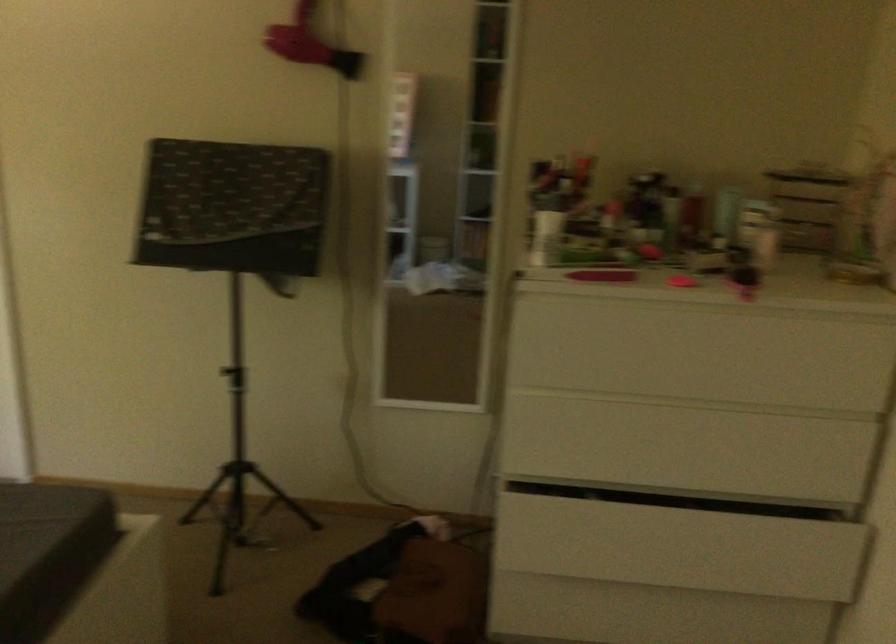
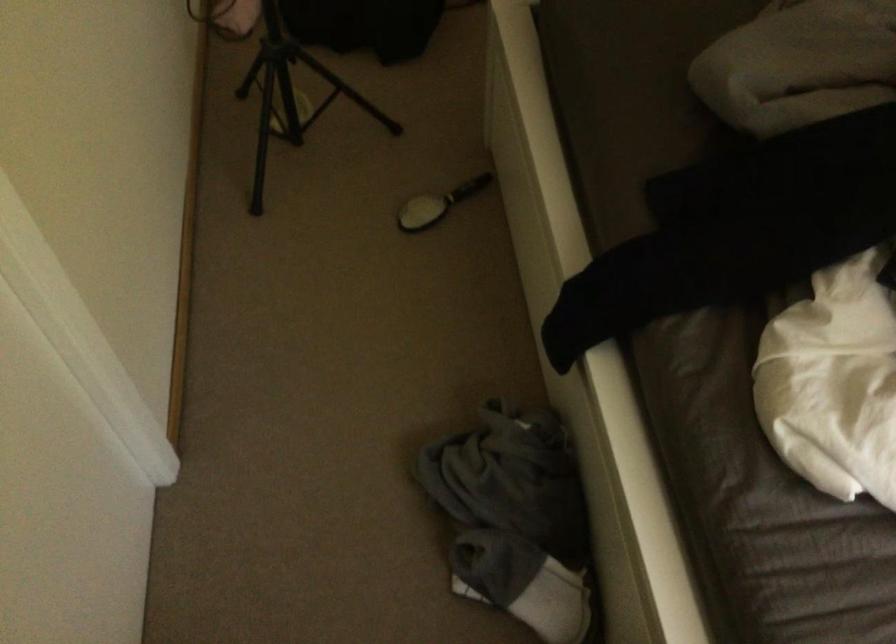
Find the pixel in the second image that matches point (203, 453) in the first image.

(283, 93)